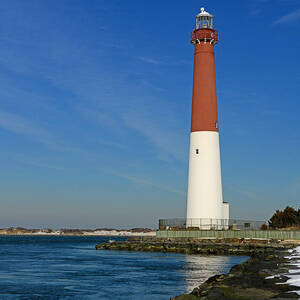
You are a GUI agent. You are given a task and a screenshot of the screen. Output one action in this format:
    pyautogui.click(x=<x>, y=<y>)
    Task: Click on the window
    
    Given the screenshot: What is the action you would take?
    pyautogui.click(x=196, y=153)